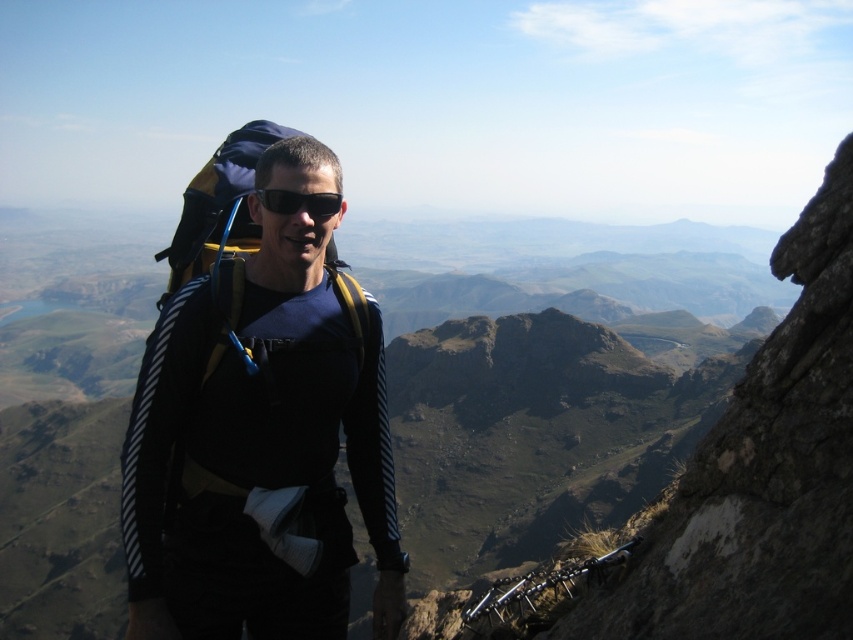
Question: In this image, where is black matte backpack at center located relative to black matte sunglasses at center?

Choices:
 (A) below
 (B) above

Answer: (A)

Question: Which object is farther from the camera taking this photo?

Choices:
 (A) black matte sunglasses at center
 (B) black matte backpack at center

Answer: (A)

Question: Does black matte backpack at center lie behind black matte sunglasses at center?

Choices:
 (A) yes
 (B) no

Answer: (B)

Question: Among these points, which one is nearest to the camera?

Choices:
 (A) (332, 209)
 (B) (189, 326)

Answer: (B)

Question: Does black matte backpack at center appear on the left side of black matte sunglasses at center?

Choices:
 (A) yes
 (B) no

Answer: (B)

Question: Which point is farther to the camera?

Choices:
 (A) black matte backpack at center
 (B) black matte sunglasses at center

Answer: (B)